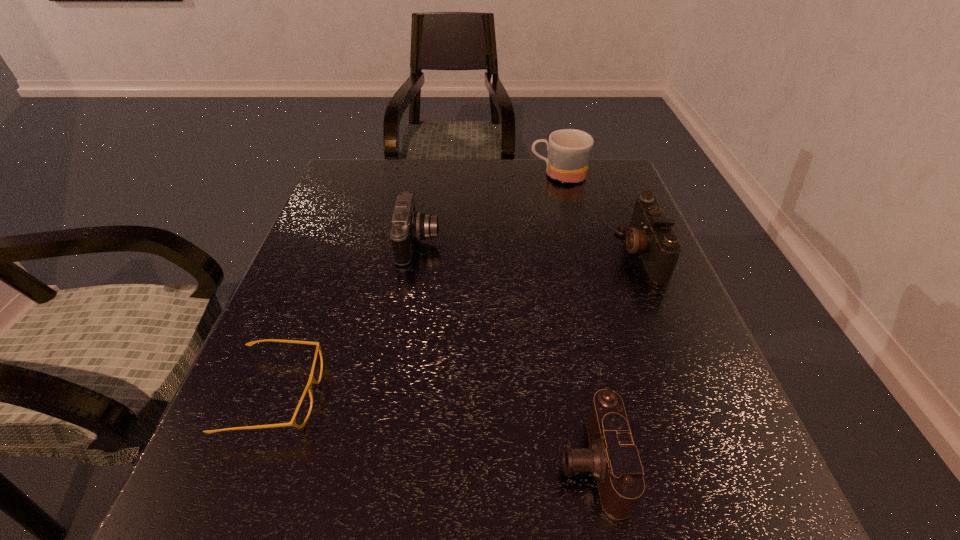
You are a GUI agent. You are given a task and a screenshot of the screen. Output one action in this format:
    pyautogui.click(x=<x>, y=<y>)
    Task: Click on the object positioned at the left edge
    This screenshot has height=540, width=960.
    Given the screenshot: What is the action you would take?
    pyautogui.click(x=311, y=380)

Identify the location of mug positioned at the right edge. This screenshot has height=540, width=960. (569, 150).

Where is `camera present at the right edge`? The height and width of the screenshot is (540, 960). camera present at the right edge is located at coordinates (650, 234).

The width and height of the screenshot is (960, 540). Identify the location of object that is positioned at the far right corner. (569, 150).

Where is `vacant space at the far edge of the desktop`? The image size is (960, 540). vacant space at the far edge of the desktop is located at coordinates (470, 167).

In the image, there is a desktop. At what (x,y) coordinates should I click in order to perform the action: click on free region at the near edge. Please return your answer as a coordinate pair (x, y). This screenshot has width=960, height=540. Looking at the image, I should click on (546, 522).

In the image, there is a desktop. In order to click on free space at the left edge in this screenshot , I will do `click(355, 278)`.

Identify the location of free region at the right edge of the desktop. (612, 328).

This screenshot has height=540, width=960. I want to click on vacant space at the far left corner of the desktop, so click(352, 185).

Where is `free space between the rightmost camera and the leftmost camera`? This screenshot has height=540, width=960. free space between the rightmost camera and the leftmost camera is located at coordinates (530, 248).